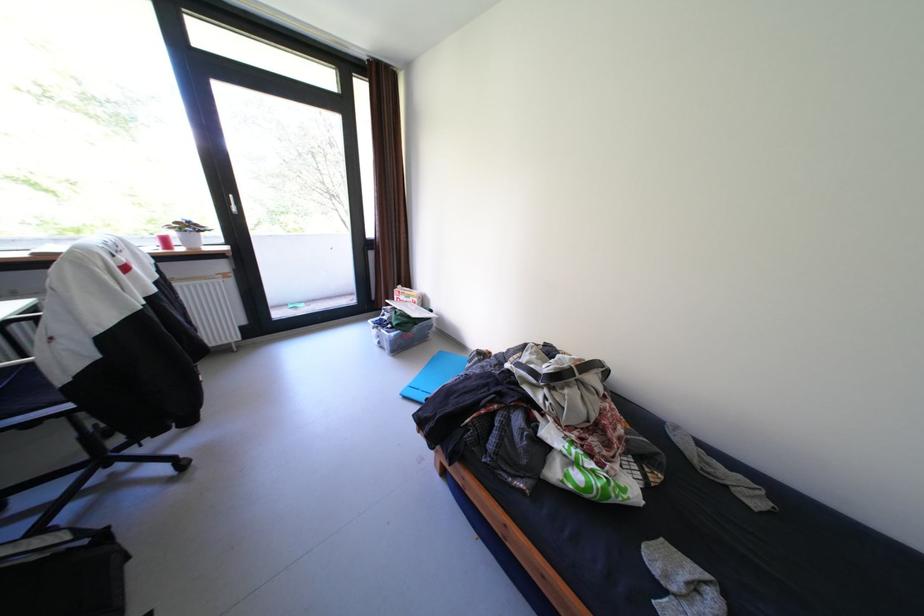
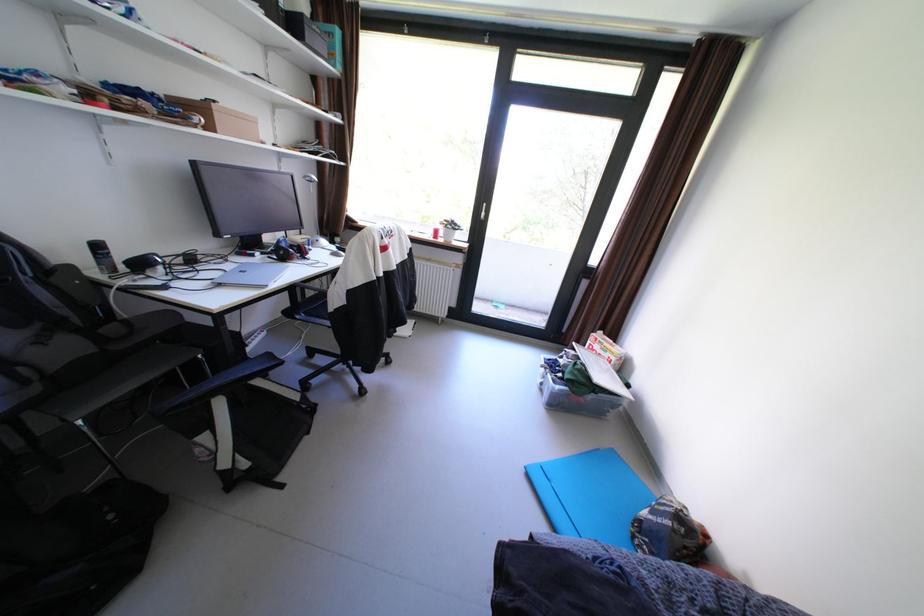
Question: The camera is either moving clockwise (left) or counter-clockwise (right) around the object. The first image is from the beginning of the video and the second image is from the end. Is the camera moving left or right when shooting the video?

Choices:
 (A) Left
 (B) Right

Answer: (B)